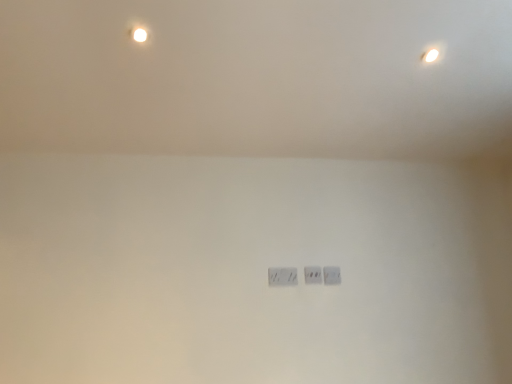
Image resolution: width=512 pixels, height=384 pixels. I want to click on white plastic power plugs and sockets at center, marked as the 3th power plugs and sockets in a right-to-left arrangement, so click(x=282, y=276).

Image resolution: width=512 pixels, height=384 pixels. I want to click on white plastic power plugs and sockets at center, which is the second power plugs and sockets in left-to-right order, so click(x=313, y=275).

Image resolution: width=512 pixels, height=384 pixels. I want to click on white plastic power plugs and sockets at center, marked as the 3th power plugs and sockets in a right-to-left arrangement, so click(x=282, y=276).

Considering the relative positions of white plastic power plugs and sockets at center, which is the second power plugs and sockets in left-to-right order, and white plastic power plugs and sockets at center, placed as the third power plugs and sockets when sorted from left to right, in the image provided, is white plastic power plugs and sockets at center, which is the second power plugs and sockets in left-to-right order, behind white plastic power plugs and sockets at center, placed as the third power plugs and sockets when sorted from left to right,?

No, white plastic power plugs and sockets at center, which is the second power plugs and sockets in left-to-right order, is closer to the camera.

Is white plastic power plugs and sockets at center, which is the second power plugs and sockets in left-to-right order, oriented away from white plastic power plugs and sockets at center, placed as the third power plugs and sockets when sorted from left to right?

No, white plastic power plugs and sockets at center, which is the second power plugs and sockets in left-to-right order, is not facing away from white plastic power plugs and sockets at center, placed as the third power plugs and sockets when sorted from left to right.

Is white plastic power plugs and sockets at center, the first power plugs and sockets positioned from the right, inside white plastic power plugs and sockets at center, which ranks as the 2th power plugs and sockets in right-to-left order?

That's incorrect, white plastic power plugs and sockets at center, the first power plugs and sockets positioned from the right, is not inside white plastic power plugs and sockets at center, which ranks as the 2th power plugs and sockets in right-to-left order.

This screenshot has height=384, width=512. Identify the location of light bulb located above the white plastic power plugs and sockets at center, the first power plugs and sockets positioned from the right (from a real-world perspective). tap(139, 35).

Between matte white light bulb at upper left and white plastic power plugs and sockets at center, placed as the third power plugs and sockets when sorted from left to right, which one has larger size?

With larger size is white plastic power plugs and sockets at center, placed as the third power plugs and sockets when sorted from left to right.

Is matte white light bulb at upper left at the right side of white plastic power plugs and sockets at center, the first power plugs and sockets positioned from the right?

In fact, matte white light bulb at upper left is to the left of white plastic power plugs and sockets at center, the first power plugs and sockets positioned from the right.

Which object is further away from the camera taking this photo, matte white light bulb at upper left or white plastic power plugs and sockets at center, placed as the third power plugs and sockets when sorted from left to right?

white plastic power plugs and sockets at center, placed as the third power plugs and sockets when sorted from left to right, is more distant.

Does white plastic power plugs and sockets at center, which ranks as the 2th power plugs and sockets in right-to-left order, touch white plastic power plugs and sockets at center, marked as the 3th power plugs and sockets in a right-to-left arrangement?

No.

Which is behind, point (315, 282) or point (292, 281)?

Point (315, 282)

Does white plastic power plugs and sockets at center, which ranks as the 2th power plugs and sockets in right-to-left order, have a lesser height compared to white plastic power plugs and sockets at center, marked as the 3th power plugs and sockets in a right-to-left arrangement?

Indeed, white plastic power plugs and sockets at center, which ranks as the 2th power plugs and sockets in right-to-left order, has a lesser height compared to white plastic power plugs and sockets at center, marked as the 3th power plugs and sockets in a right-to-left arrangement.

Looking at this image, between white plastic power plugs and sockets at center, which ranks as the 2th power plugs and sockets in right-to-left order, and white plastic power plugs and sockets at center, which is counted as the first power plugs and sockets, starting from the left, which one has smaller size?

Smaller between the two is white plastic power plugs and sockets at center, which ranks as the 2th power plugs and sockets in right-to-left order.

Considering the relative sizes of matte white light bulb at upper left and white plastic power plugs and sockets at center, which ranks as the 2th power plugs and sockets in right-to-left order, in the image provided, is matte white light bulb at upper left bigger than white plastic power plugs and sockets at center, which ranks as the 2th power plugs and sockets in right-to-left order,?

No, matte white light bulb at upper left is not bigger than white plastic power plugs and sockets at center, which ranks as the 2th power plugs and sockets in right-to-left order.

Could you measure the distance between matte white light bulb at upper left and white plastic power plugs and sockets at center, which is the second power plugs and sockets in left-to-right order?

The distance of matte white light bulb at upper left from white plastic power plugs and sockets at center, which is the second power plugs and sockets in left-to-right order, is 1.35 meters.

Is matte white light bulb at upper left behind white plastic power plugs and sockets at center, which ranks as the 2th power plugs and sockets in right-to-left order?

No, matte white light bulb at upper left is closer to the camera.

Are matte white light bulb at upper left and white plastic power plugs and sockets at center, which is the second power plugs and sockets in left-to-right order, located far from each other?

Yes.

What's the angular difference between matte white light bulb at upper left and white plastic power plugs and sockets at center, marked as the 3th power plugs and sockets in a right-to-left arrangement,'s facing directions?

matte white light bulb at upper left and white plastic power plugs and sockets at center, marked as the 3th power plugs and sockets in a right-to-left arrangement, are facing 3.06 degrees away from each other.

From a real-world perspective, who is located lower, matte white light bulb at upper left or white plastic power plugs and sockets at center, marked as the 3th power plugs and sockets in a right-to-left arrangement?

white plastic power plugs and sockets at center, marked as the 3th power plugs and sockets in a right-to-left arrangement, from a real-world perspective.

Between matte white light bulb at upper left and white plastic power plugs and sockets at center, which is counted as the first power plugs and sockets, starting from the left, which one has larger width?

matte white light bulb at upper left is wider.

Between matte white light bulb at upper left and white plastic power plugs and sockets at center, marked as the 3th power plugs and sockets in a right-to-left arrangement, which one appears on the right side from the viewer's perspective?

white plastic power plugs and sockets at center, marked as the 3th power plugs and sockets in a right-to-left arrangement, is more to the right.

Considering the sizes of white plastic power plugs and sockets at center, marked as the 3th power plugs and sockets in a right-to-left arrangement, and white plastic power plugs and sockets at center, which is the second power plugs and sockets in left-to-right order, in the image, is white plastic power plugs and sockets at center, marked as the 3th power plugs and sockets in a right-to-left arrangement, taller or shorter than white plastic power plugs and sockets at center, which is the second power plugs and sockets in left-to-right order,?

Clearly, white plastic power plugs and sockets at center, marked as the 3th power plugs and sockets in a right-to-left arrangement, is taller compared to white plastic power plugs and sockets at center, which is the second power plugs and sockets in left-to-right order.

Could you tell me if white plastic power plugs and sockets at center, which is counted as the first power plugs and sockets, starting from the left, is facing white plastic power plugs and sockets at center, which is the second power plugs and sockets in left-to-right order?

No.

Consider the image. From a real-world perspective, between white plastic power plugs and sockets at center, which is counted as the first power plugs and sockets, starting from the left, and white plastic power plugs and sockets at center, which ranks as the 2th power plugs and sockets in right-to-left order, who is vertically higher?

From a 3D spatial view, white plastic power plugs and sockets at center, which ranks as the 2th power plugs and sockets in right-to-left order, is above.

In the scene shown: From the image's perspective, is white plastic power plugs and sockets at center, marked as the 3th power plugs and sockets in a right-to-left arrangement, on white plastic power plugs and sockets at center, which ranks as the 2th power plugs and sockets in right-to-left order?

No, from the image's perspective, white plastic power plugs and sockets at center, marked as the 3th power plugs and sockets in a right-to-left arrangement, is not on top of white plastic power plugs and sockets at center, which ranks as the 2th power plugs and sockets in right-to-left order.

Between white plastic power plugs and sockets at center, which ranks as the 2th power plugs and sockets in right-to-left order, and matte white light bulb at upper left, which one has smaller size?

Smaller between the two is matte white light bulb at upper left.

In the scene shown: In terms of width, does white plastic power plugs and sockets at center, which is the second power plugs and sockets in left-to-right order, look wider or thinner when compared to matte white light bulb at upper left?

white plastic power plugs and sockets at center, which is the second power plugs and sockets in left-to-right order, is thinner than matte white light bulb at upper left.

From a real-world perspective, is white plastic power plugs and sockets at center, which ranks as the 2th power plugs and sockets in right-to-left order, physically located above or below matte white light bulb at upper left?

white plastic power plugs and sockets at center, which ranks as the 2th power plugs and sockets in right-to-left order, is situated lower than matte white light bulb at upper left in the real world.

Locate an element on the screen. light bulb above the white plastic power plugs and sockets at center, which is the second power plugs and sockets in left-to-right order (from the image's perspective) is located at coordinates (139, 35).

The width and height of the screenshot is (512, 384). I want to click on power plugs and sockets that is the 1st object located below the white plastic power plugs and sockets at center, which ranks as the 2th power plugs and sockets in right-to-left order (from the image's perspective), so click(x=331, y=275).

Where is `light bulb in front of the white plastic power plugs and sockets at center, placed as the third power plugs and sockets when sorted from left to right`? light bulb in front of the white plastic power plugs and sockets at center, placed as the third power plugs and sockets when sorted from left to right is located at coordinates (139, 35).

Looking at the image, which one is located further to white plastic power plugs and sockets at center, which is counted as the first power plugs and sockets, starting from the left, white plastic power plugs and sockets at center, placed as the third power plugs and sockets when sorted from left to right, or matte white light bulb at upper left?

Among the two, matte white light bulb at upper left is located further to white plastic power plugs and sockets at center, which is counted as the first power plugs and sockets, starting from the left.

Based on their spatial positions, is white plastic power plugs and sockets at center, marked as the 3th power plugs and sockets in a right-to-left arrangement, or matte white light bulb at upper left further from white plastic power plugs and sockets at center, placed as the third power plugs and sockets when sorted from left to right?

matte white light bulb at upper left lies further to white plastic power plugs and sockets at center, placed as the third power plugs and sockets when sorted from left to right, than the other object.

Which object lies nearer to the anchor point matte white light bulb at upper left, white plastic power plugs and sockets at center, placed as the third power plugs and sockets when sorted from left to right, or white plastic power plugs and sockets at center, which is the second power plugs and sockets in left-to-right order?

Based on the image, white plastic power plugs and sockets at center, which is the second power plugs and sockets in left-to-right order, appears to be nearer to matte white light bulb at upper left.

Estimate the real-world distances between objects in this image. Which object is further from matte white light bulb at upper left, white plastic power plugs and sockets at center, which is counted as the first power plugs and sockets, starting from the left, or white plastic power plugs and sockets at center, the first power plugs and sockets positioned from the right?

white plastic power plugs and sockets at center, the first power plugs and sockets positioned from the right, lies further to matte white light bulb at upper left than the other object.

Estimate the real-world distances between objects in this image. Which object is further from white plastic power plugs and sockets at center, the first power plugs and sockets positioned from the right, white plastic power plugs and sockets at center, which is counted as the first power plugs and sockets, starting from the left, or white plastic power plugs and sockets at center, which is the second power plugs and sockets in left-to-right order?

white plastic power plugs and sockets at center, which is counted as the first power plugs and sockets, starting from the left, lies further to white plastic power plugs and sockets at center, the first power plugs and sockets positioned from the right, than the other object.

Considering their positions, is matte white light bulb at upper left positioned further to white plastic power plugs and sockets at center, marked as the 3th power plugs and sockets in a right-to-left arrangement, than white plastic power plugs and sockets at center, which is the second power plugs and sockets in left-to-right order?

matte white light bulb at upper left is further to white plastic power plugs and sockets at center, marked as the 3th power plugs and sockets in a right-to-left arrangement.

From the image, which object appears to be nearer to white plastic power plugs and sockets at center, placed as the third power plugs and sockets when sorted from left to right, matte white light bulb at upper left or white plastic power plugs and sockets at center, which is the second power plugs and sockets in left-to-right order?

The object closer to white plastic power plugs and sockets at center, placed as the third power plugs and sockets when sorted from left to right, is white plastic power plugs and sockets at center, which is the second power plugs and sockets in left-to-right order.

Considering their positions, is white plastic power plugs and sockets at center, which is counted as the first power plugs and sockets, starting from the left, positioned further to white plastic power plugs and sockets at center, which is the second power plugs and sockets in left-to-right order, than white plastic power plugs and sockets at center, placed as the third power plugs and sockets when sorted from left to right?

white plastic power plugs and sockets at center, which is counted as the first power plugs and sockets, starting from the left, lies further to white plastic power plugs and sockets at center, which is the second power plugs and sockets in left-to-right order, than the other object.

Locate an element on the screen. power plugs and sockets situated between white plastic power plugs and sockets at center, which is counted as the first power plugs and sockets, starting from the left, and white plastic power plugs and sockets at center, placed as the third power plugs and sockets when sorted from left to right, from left to right is located at coordinates (313, 275).

Locate an element on the screen. power plugs and sockets between matte white light bulb at upper left and white plastic power plugs and sockets at center, the first power plugs and sockets positioned from the right, in the vertical direction is located at coordinates (x=313, y=275).